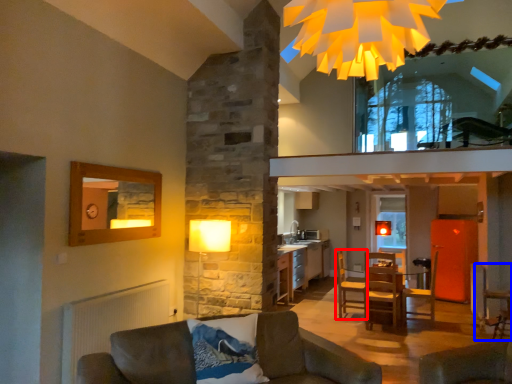
Question: Which point is further to the camera, armchair (highlighted by a red box) or armchair (highlighted by a blue box)?

Choices:
 (A) armchair
 (B) armchair

Answer: (A)